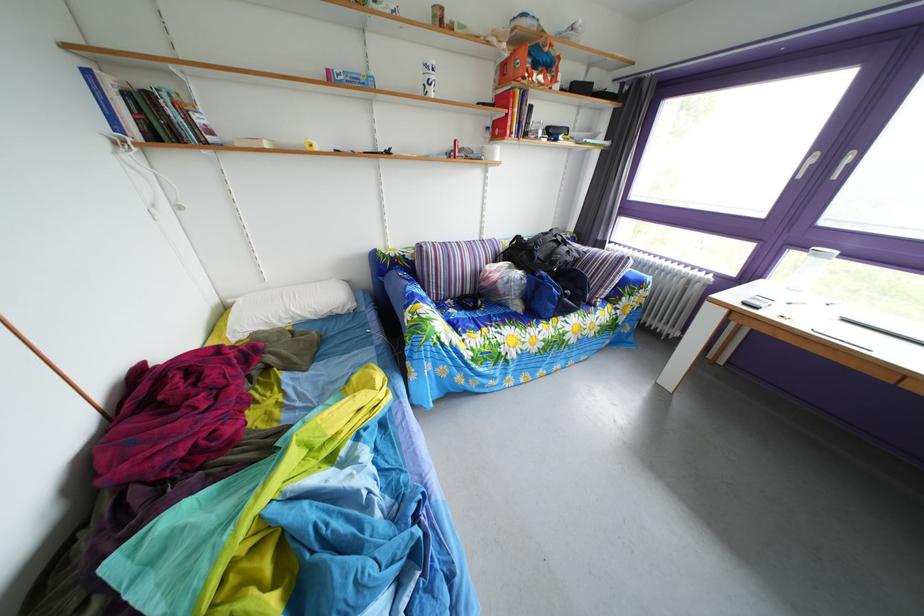
Describe the element at coordinates (513, 330) in the screenshot. I see `the sofa sitting surface` at that location.